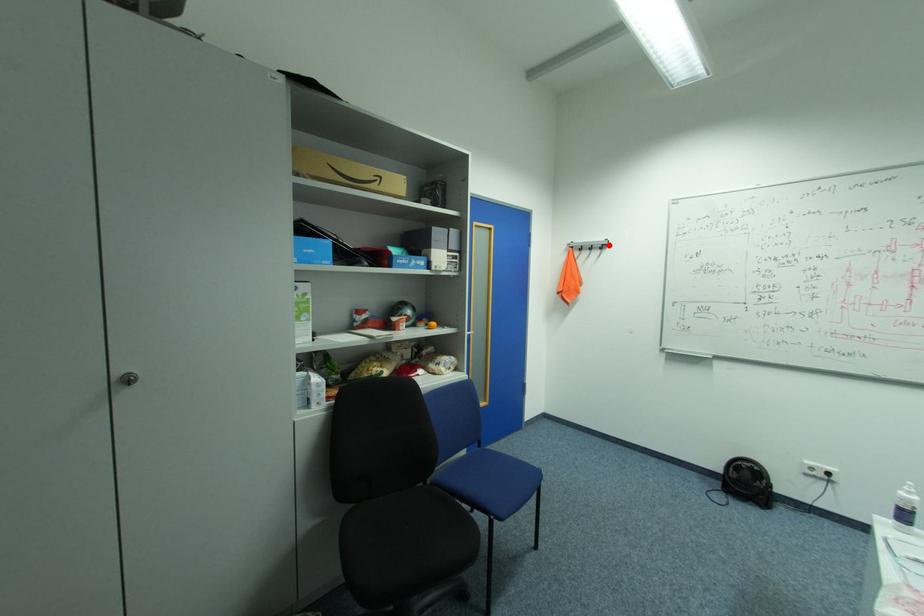
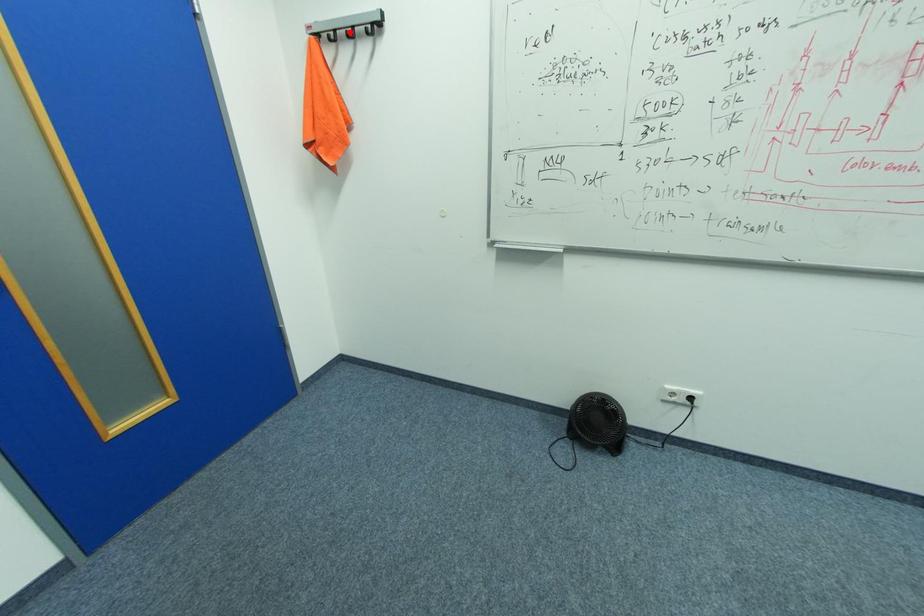
I am providing you with two images of the same scene from different viewpoints. A red point is marked on the first image and another point is marked on the second image. Are the points marked in image1 and image2 representing the same 3D position?

No